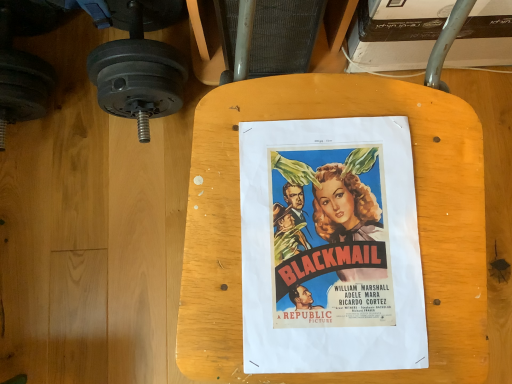
Question: From the image's perspective, does matte black dumbbell at left appear higher than matte paper poster at center?

Choices:
 (A) no
 (B) yes

Answer: (B)

Question: Does matte black dumbbell at left have a greater width compared to matte paper poster at center?

Choices:
 (A) yes
 (B) no

Answer: (A)

Question: From a real-world perspective, is matte black dumbbell at left located higher than matte paper poster at center?

Choices:
 (A) yes
 (B) no

Answer: (B)

Question: Is matte black dumbbell at left located outside matte paper poster at center?

Choices:
 (A) yes
 (B) no

Answer: (A)

Question: Is matte black dumbbell at left to the left of matte paper poster at center from the viewer's perspective?

Choices:
 (A) no
 (B) yes

Answer: (B)

Question: Can you confirm if matte black dumbbell at left is thinner than matte paper poster at center?

Choices:
 (A) no
 (B) yes

Answer: (A)

Question: Would you consider wooden table at center to be distant from matte paper poster at center?

Choices:
 (A) yes
 (B) no

Answer: (B)

Question: From a real-world perspective, is wooden table at center below matte paper poster at center?

Choices:
 (A) yes
 (B) no

Answer: (A)

Question: Can you confirm if wooden table at center is bigger than matte paper poster at center?

Choices:
 (A) yes
 (B) no

Answer: (A)

Question: Is wooden table at center positioned before matte paper poster at center?

Choices:
 (A) yes
 (B) no

Answer: (A)

Question: Can matte paper poster at center be found inside wooden table at center?

Choices:
 (A) yes
 (B) no

Answer: (A)

Question: Considering the relative positions of wooden table at center and matte paper poster at center in the image provided, is wooden table at center to the left of matte paper poster at center from the viewer's perspective?

Choices:
 (A) no
 (B) yes

Answer: (A)

Question: Is matte paper poster at center looking in the opposite direction of matte black dumbbell at left?

Choices:
 (A) yes
 (B) no

Answer: (B)